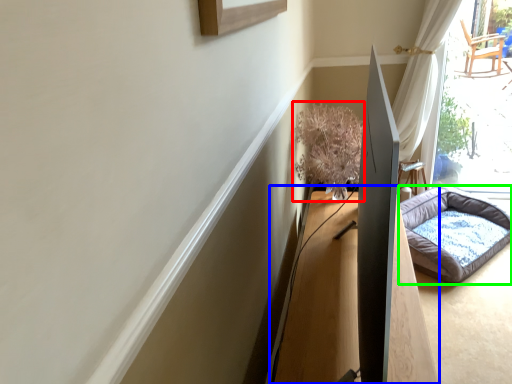
Question: Estimate the real-world distances between objects in this image. Which object is farther from plant (highlighted by a red box), table (highlighted by a blue box) or dog bed (highlighted by a green box)?

Choices:
 (A) table
 (B) dog bed

Answer: (B)